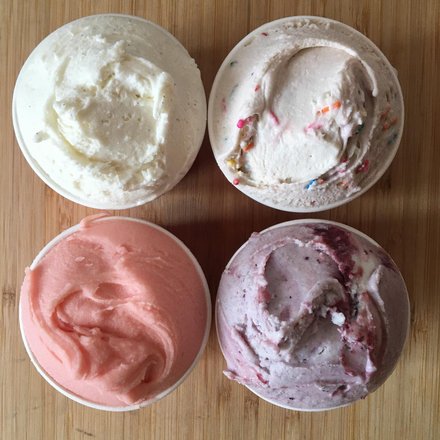
At what (x,y) coordinates should I click in order to perform the action: click on table. Please return your answer as a coordinate pair (x, y). This screenshot has height=440, width=440. Looking at the image, I should click on (210, 214).